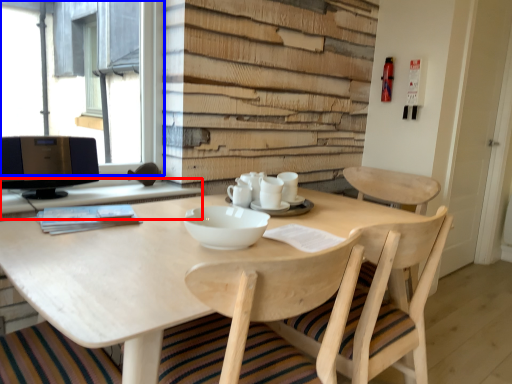
Question: Which point is closer to the camera, computer desk (highlighted by a red box) or window (highlighted by a blue box)?

Choices:
 (A) computer desk
 (B) window

Answer: (A)